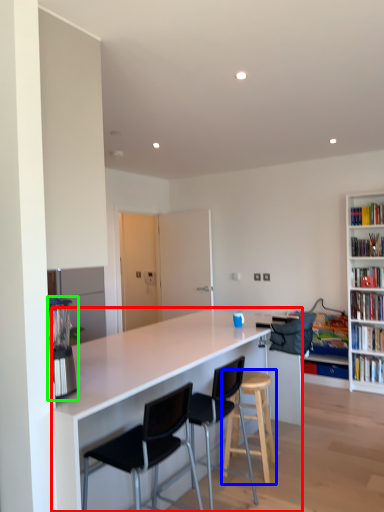
Question: Which object is the farthest from countertop (highlighted by a red box)? Choose among these: stool (highlighted by a blue box) or appliance (highlighted by a green box).

Choices:
 (A) stool
 (B) appliance

Answer: (B)